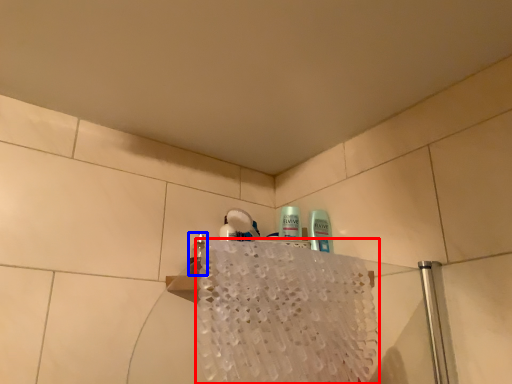
Question: Which of the following is the closest to the observer, bath towel (highlighted by a red box) or mouthwash (highlighted by a blue box)?

Choices:
 (A) bath towel
 (B) mouthwash

Answer: (A)